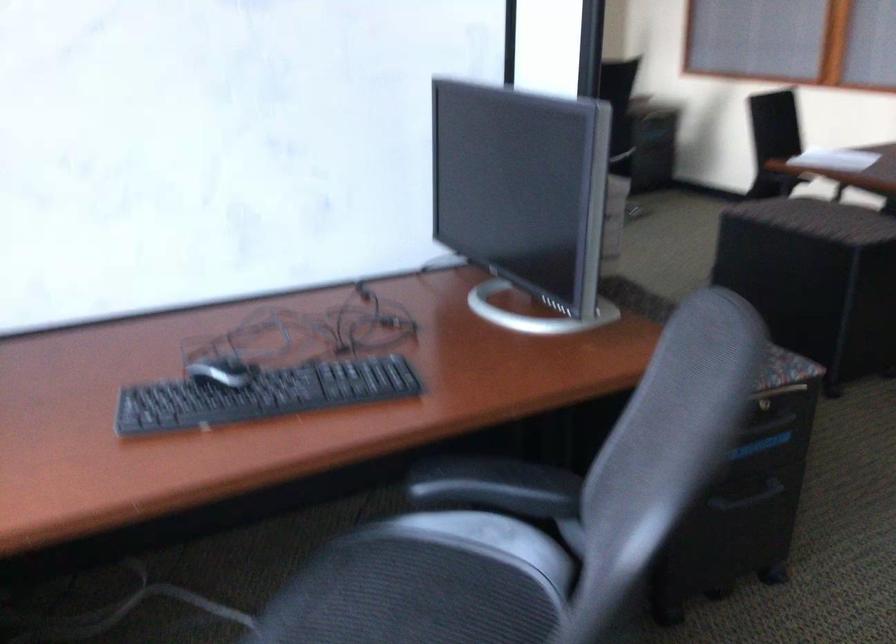
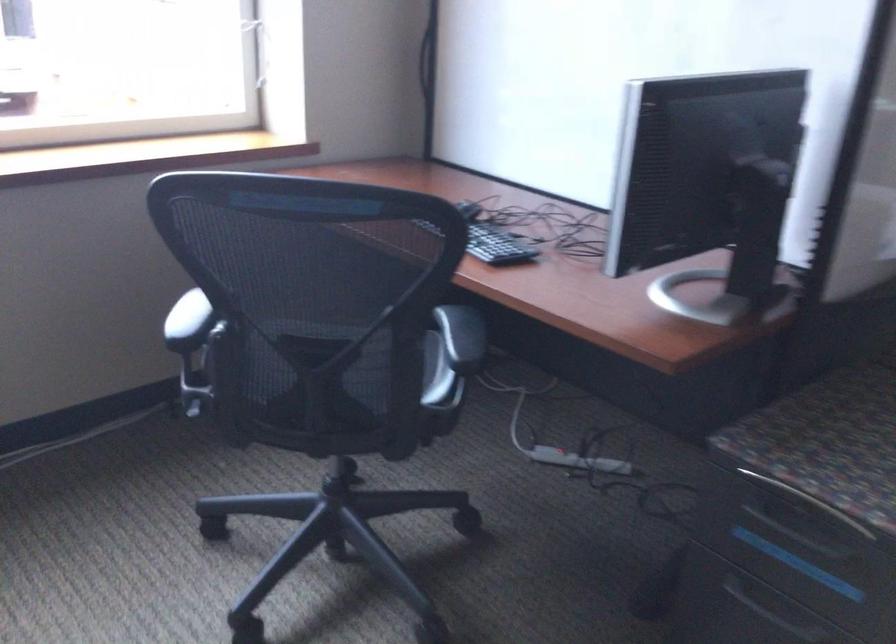
Locate, in the second image, the point that corresponds to [771,420] in the first image.

(800, 536)